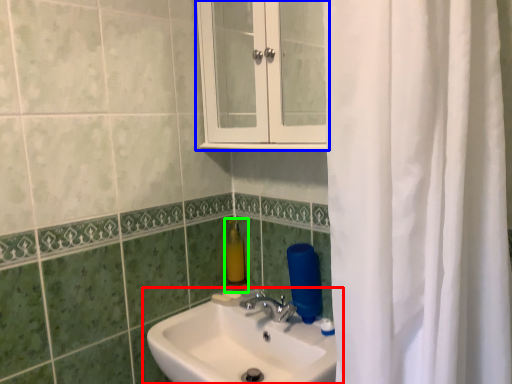
Question: Which object is positioned closest to sink (highlighted by a red box)? Select from medicine cabinet (highlighted by a blue box) and soap dispenser (highlighted by a green box).

Choices:
 (A) medicine cabinet
 (B) soap dispenser

Answer: (B)